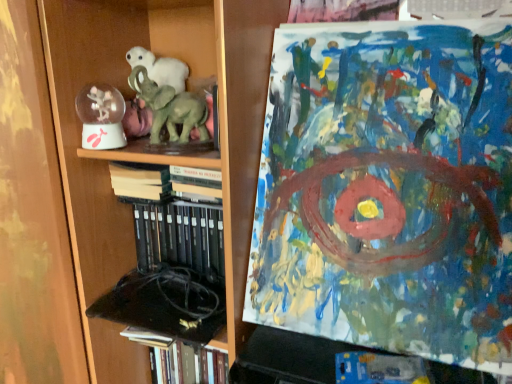
Question: Is green matte elephant at center shorter than hardcover book at lower left, positioned as the 2th book in top-to-bottom order?

Choices:
 (A) yes
 (B) no

Answer: (A)

Question: Can you confirm if green matte elephant at center is thinner than hardcover book at lower left, positioned as the 2th book in top-to-bottom order?

Choices:
 (A) yes
 (B) no

Answer: (A)

Question: Does green matte elephant at center have a smaller size compared to hardcover book at lower left, placed as the first book when sorted from bottom to top?

Choices:
 (A) yes
 (B) no

Answer: (A)

Question: From a real-world perspective, is green matte elephant at center located beneath hardcover book at lower left, positioned as the 2th book in top-to-bottom order?

Choices:
 (A) no
 (B) yes

Answer: (A)

Question: Is the position of green matte elephant at center more distant than that of hardcover book at lower left, positioned as the 2th book in top-to-bottom order?

Choices:
 (A) yes
 (B) no

Answer: (B)

Question: Is hardcover book at lower left, placed as the first book when sorted from bottom to top, inside or outside of hardcover books at center, the first book positioned from the top?

Choices:
 (A) outside
 (B) inside

Answer: (A)

Question: Does point (205, 367) appear closer or farther from the camera than point (202, 168)?

Choices:
 (A) farther
 (B) closer

Answer: (A)

Question: Is hardcover book at lower left, positioned as the 2th book in top-to-bottom order, taller or shorter than hardcover books at center, the 2th book in the bottom-to-top sequence?

Choices:
 (A) short
 (B) tall

Answer: (B)

Question: From the image's perspective, relative to hardcover books at center, the first book positioned from the top, is hardcover book at lower left, positioned as the 2th book in top-to-bottom order, above or below?

Choices:
 (A) below
 (B) above

Answer: (A)

Question: From the image's perspective, is green matte elephant at center above or below hardcover books at center, the first book positioned from the top?

Choices:
 (A) above
 (B) below

Answer: (A)

Question: From a real-world perspective, is green matte elephant at center physically located above or below hardcover books at center, the 2th book in the bottom-to-top sequence?

Choices:
 (A) above
 (B) below

Answer: (A)

Question: Is green matte elephant at center wider or thinner than hardcover books at center, the 2th book in the bottom-to-top sequence?

Choices:
 (A) wide
 (B) thin

Answer: (B)

Question: In the image, is green matte elephant at center positioned in front of or behind hardcover books at center, the first book positioned from the top?

Choices:
 (A) front
 (B) behind

Answer: (A)

Question: Looking at the image, does hardcover books at center, the 2th book in the bottom-to-top sequence, seem bigger or smaller compared to wooden bookcase at left?

Choices:
 (A) big
 (B) small

Answer: (B)

Question: Considering their positions, is hardcover books at center, the 2th book in the bottom-to-top sequence, located in front of or behind wooden bookcase at left?

Choices:
 (A) behind
 (B) front

Answer: (A)